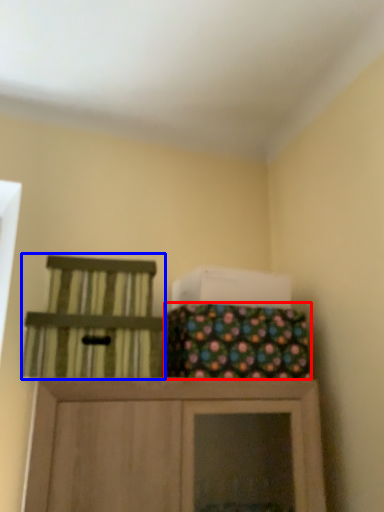
Question: Which point is closer to the camera, material (highlighted by a red box) or chair (highlighted by a blue box)?

Choices:
 (A) material
 (B) chair

Answer: (B)